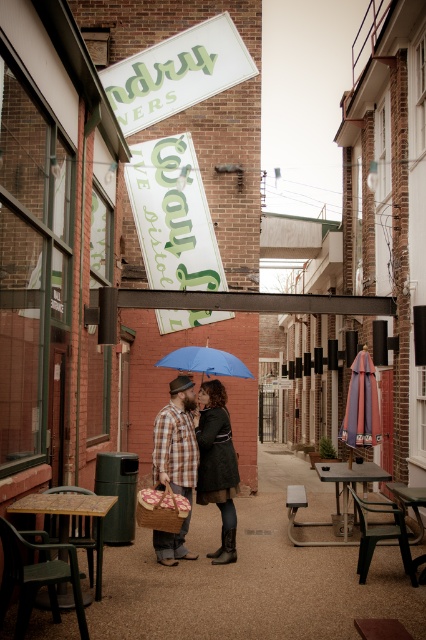
You are a customer looking for a spot to sit under the blue matte umbrella at center. Which direction should you move relative to the wooden picnic table at lower left?

→ You should move to the right side of the wooden picnic table at lower left to reach the blue matte umbrella at center since the wooden picnic table at lower left is positioned on the left side of it.

In the scene shown: You are a customer looking for a shaded spot to sit at the picnic table. Can you sit under the blue matte umbrella at center while using the metallic silver picnic table at lower right?

The blue matte umbrella at center is above the metallic silver picnic table at lower right, so yes, you can sit under the blue matte umbrella at center while using the metallic silver picnic table at lower right because the umbrella provides shade over the table.

You are a delivery person carrying a package that is 2 meters long. You need to place it between the wooden picnic table at lower left and the blue matte umbrella at center. Will the package fit in the space between them?

The wooden picnic table at lower left and blue matte umbrella at center are 2.40 meters apart, so the 2 meter long package will fit in the space between them since it is shorter than the distance between the two objects.